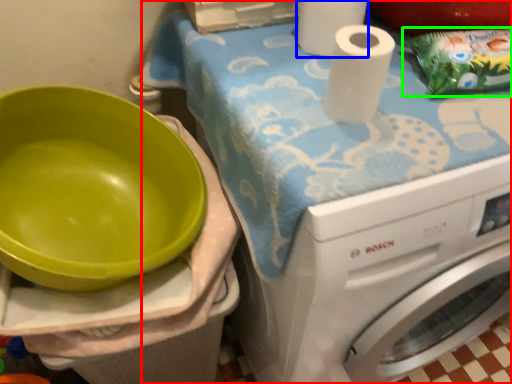
Question: Which object is positioned farthest from machine (highlighted by a red box)? Select from paper towel (highlighted by a blue box) and waste (highlighted by a green box).

Choices:
 (A) paper towel
 (B) waste

Answer: (A)